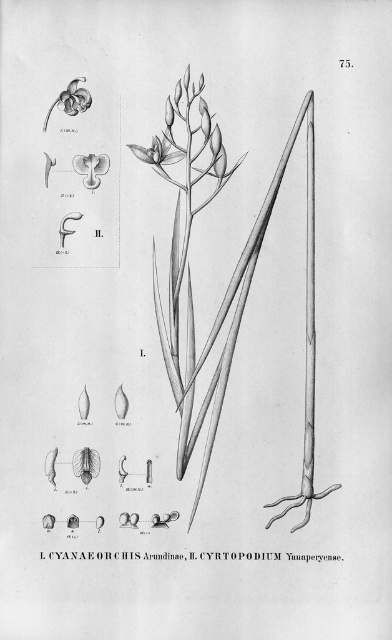
Does matte white flower at upper center come in front of matte white orchid at upper left?

No, it is not.

Is point (130, 148) positioned before point (72, 104)?

No, (130, 148) is further to viewer.

Where is `matte white flower at upper center`? The height and width of the screenshot is (640, 392). matte white flower at upper center is located at coordinates (157, 150).

Does matte white flower at upper left appear under matte white orchid at upper left?

Yes.

Can you confirm if matte white flower at upper left is bigger than matte white orchid at upper left?

No.

Which is behind, point (88, 161) or point (79, 93)?

The point (88, 161) is behind.

Find the location of a particular element. Image resolution: width=392 pixels, height=640 pixels. matte white flower at upper left is located at coordinates (90, 168).

Based on the photo, between matte white flower at upper center and matte white flower at upper left, which one has more height?

With more height is matte white flower at upper left.

Does matte white flower at upper center lie in front of matte white flower at upper left?

No, matte white flower at upper center is behind matte white flower at upper left.

Does point (159, 138) come behind point (81, 163)?

Yes, point (159, 138) is farther from viewer.

Identify the location of matte white flower at upper center. This screenshot has height=640, width=392. (157, 150).